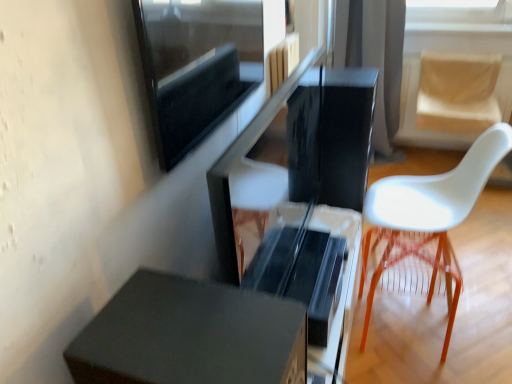
Question: Is beige fabric swivel chair at right situated inside translucent orange stool at right or outside?

Choices:
 (A) outside
 (B) inside

Answer: (A)

Question: From a real-world perspective, is beige fabric swivel chair at right physically located above or below translucent orange stool at right?

Choices:
 (A) above
 (B) below

Answer: (A)

Question: Which object is positioned closest to the white plastic chair at right?

Choices:
 (A) matte black drawer at lower left
 (B) matte black screen at upper left
 (C) beige fabric swivel chair at right
 (D) glossy black computer desk at center
 (E) translucent orange stool at right

Answer: (E)

Question: Considering the real-world distances, which object is farthest from the translucent orange stool at right?

Choices:
 (A) beige fabric swivel chair at right
 (B) matte black drawer at lower left
 (C) glossy black computer desk at center
 (D) matte black screen at upper left
 (E) black fabric curtain at upper center

Answer: (E)